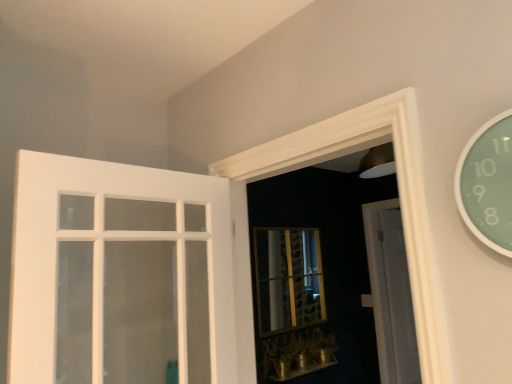
Question: Can we say metallic gold window sill at lower center lies outside gold textured glass bay window at center?

Choices:
 (A) yes
 (B) no

Answer: (A)

Question: Is metallic gold window sill at lower center smaller than gold textured glass bay window at center?

Choices:
 (A) yes
 (B) no

Answer: (A)

Question: Is metallic gold window sill at lower center to the left of gold textured glass bay window at center from the viewer's perspective?

Choices:
 (A) no
 (B) yes

Answer: (A)

Question: Are metallic gold window sill at lower center and gold textured glass bay window at center beside each other?

Choices:
 (A) no
 (B) yes

Answer: (A)

Question: Does metallic gold window sill at lower center have a lesser width compared to gold textured glass bay window at center?

Choices:
 (A) yes
 (B) no

Answer: (B)

Question: From the image's perspective, would you say metallic gold window sill at lower center is shown under gold textured glass bay window at center?

Choices:
 (A) no
 (B) yes

Answer: (B)

Question: Can you confirm if white painted wood door at left, arranged as the 2th door when viewed from the right, is bigger than white wood door at center, the first door when ordered from right to left?

Choices:
 (A) yes
 (B) no

Answer: (B)

Question: From a real-world perspective, does white painted wood door at left, which ranks as the 2th door in back-to-front order, sit lower than white wood door at center, the second door from the left?

Choices:
 (A) yes
 (B) no

Answer: (B)

Question: Considering the relative sizes of white painted wood door at left, which ranks as the 2th door in back-to-front order, and white wood door at center, the second door from the left, in the image provided, is white painted wood door at left, which ranks as the 2th door in back-to-front order, smaller than white wood door at center, the second door from the left,?

Choices:
 (A) no
 (B) yes

Answer: (B)

Question: From a real-world perspective, is white painted wood door at left, which ranks as the 2th door in back-to-front order, on white wood door at center, marked as the 2th door in a front-to-back arrangement?

Choices:
 (A) no
 (B) yes

Answer: (B)

Question: Is white painted wood door at left, arranged as the 1th door when viewed from the left, facing away from white wood door at center, the first door when ordered from right to left?

Choices:
 (A) no
 (B) yes

Answer: (A)

Question: Is white painted wood door at left, arranged as the 1th door when viewed from the left, located outside white wood door at center, marked as the 2th door in a front-to-back arrangement?

Choices:
 (A) no
 (B) yes

Answer: (B)

Question: Is white painted wood door at left, arranged as the 1th door when viewed from the left, shorter than metallic gold window sill at lower center?

Choices:
 (A) no
 (B) yes

Answer: (A)